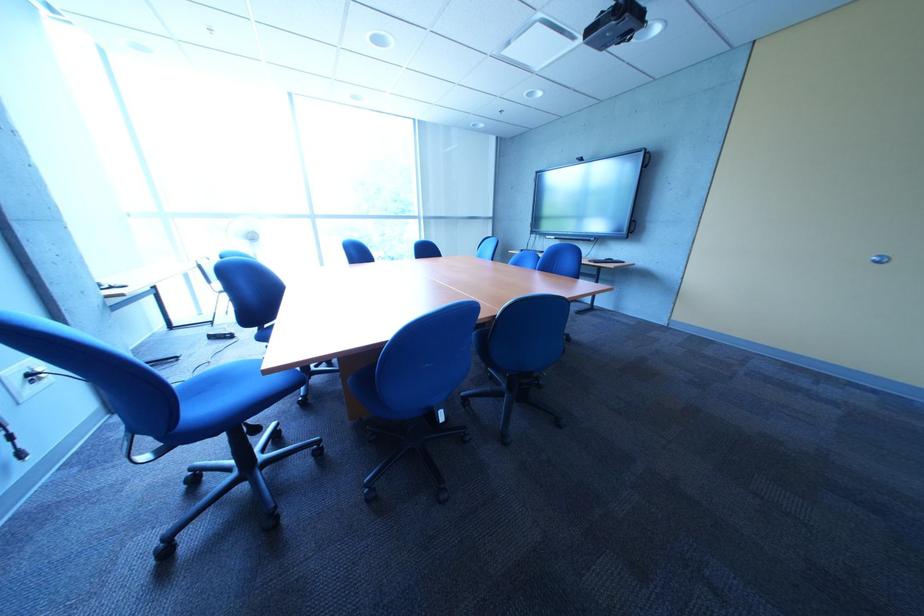
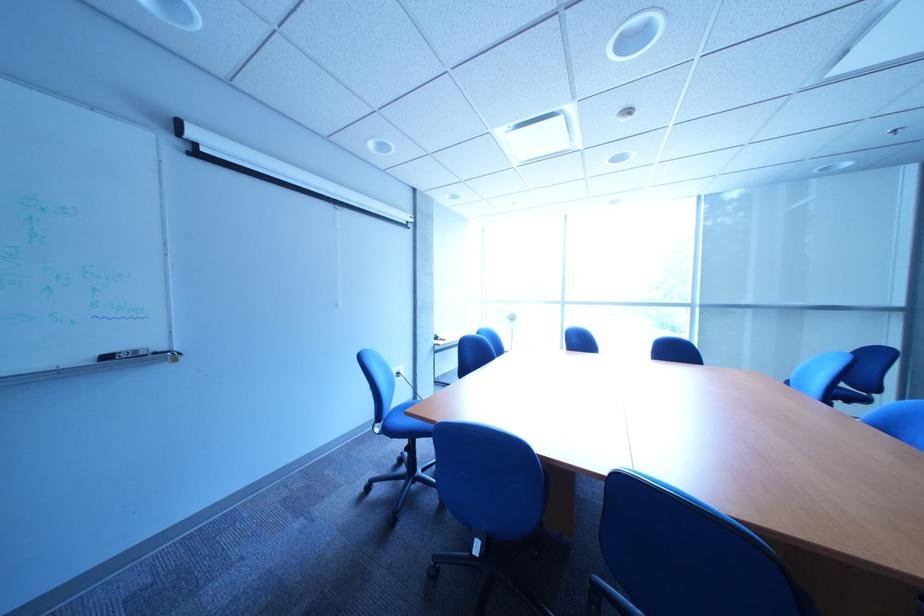
In the second image, find the point that corresponds to (160,459) in the first image.

(392, 432)